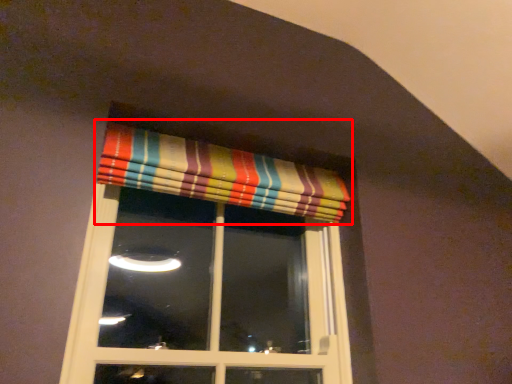
Question: Considering the relative positions of curtain (annotated by the red box) and window in the image provided, where is curtain (annotated by the red box) located with respect to the staircase?

Choices:
 (A) left
 (B) right

Answer: (B)